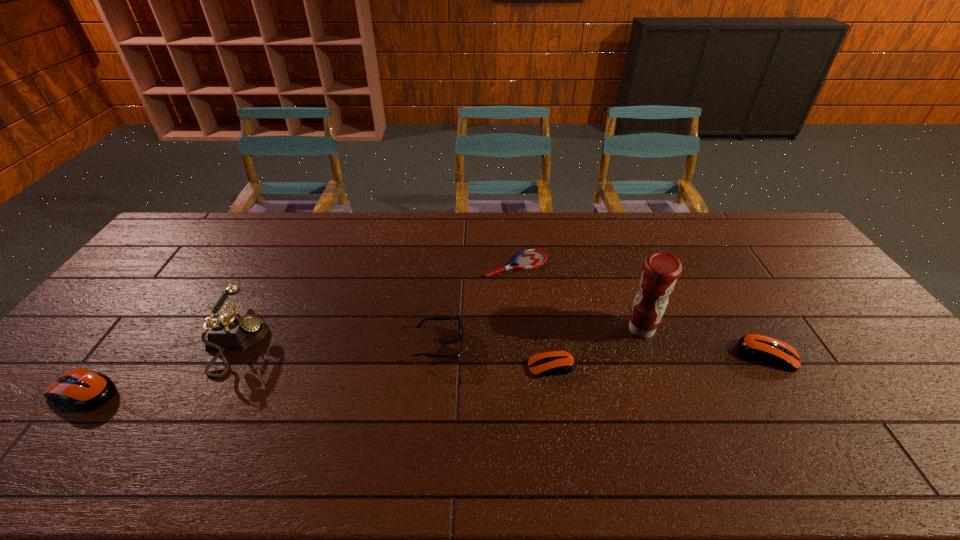
At what (x,y) coordinates should I click in order to perform the action: click on object that is positioned at the left edge. Please return your answer as a coordinate pair (x, y). The image size is (960, 540). Looking at the image, I should click on (84, 390).

Locate an element on the screen. The width and height of the screenshot is (960, 540). object that is at the near left corner is located at coordinates (84, 390).

Where is `blank space at the far edge of the desktop`? This screenshot has height=540, width=960. blank space at the far edge of the desktop is located at coordinates (563, 245).

At what (x,y) coordinates should I click in order to perform the action: click on vacant space at the near edge of the desktop. Please return your answer as a coordinate pair (x, y). The width and height of the screenshot is (960, 540). Looking at the image, I should click on (805, 396).

The width and height of the screenshot is (960, 540). In order to click on vacant space at the right edge of the desktop in this screenshot , I will do `click(794, 273)`.

Identify the location of vacant position at the far left corner of the desktop. (203, 236).

This screenshot has width=960, height=540. I want to click on vacant area that lies between the tennis racket and the second tallest object, so click(x=376, y=304).

Locate an element on the screen. The image size is (960, 540). unoccupied area between the tennis racket and the sunglasses is located at coordinates (478, 306).

Image resolution: width=960 pixels, height=540 pixels. What are the coordinates of `free area in between the shortest computer mouse and the sunglasses` in the screenshot? It's located at (495, 356).

At what (x,y) coordinates should I click in order to perform the action: click on free spot between the farthest object and the leftmost computer mouse. Please return your answer as a coordinate pair (x, y). Looking at the image, I should click on (300, 328).